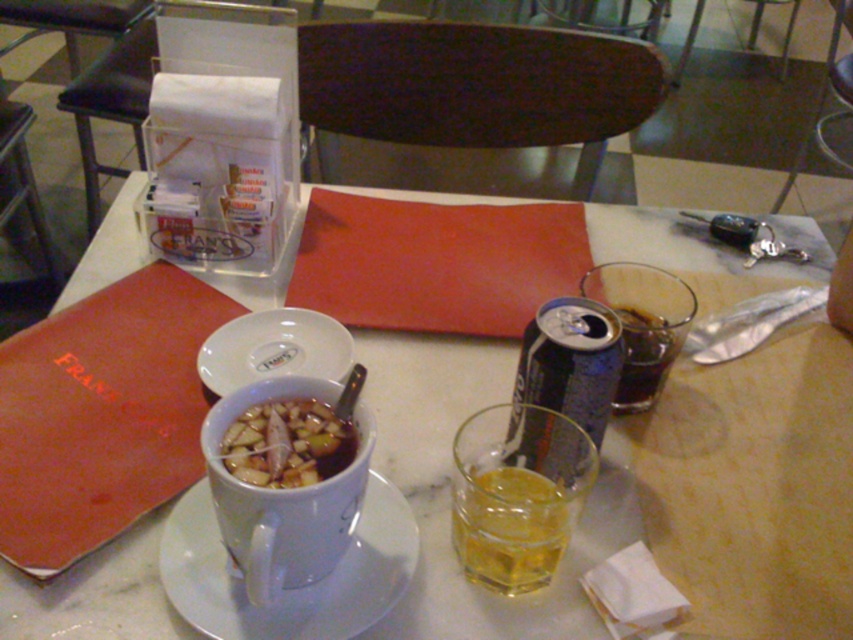
You are a customer at a restaurant and want to grab a drink. You see the metallic silver can at center and the dark brown carbonated can at upper right. Which can is bigger in size?

The metallic silver can at center is larger in size than the dark brown carbonated can at upper right.

You are a server at a restaurant and need to place a new napkin dispenser on the table. The current setup has the white plastic napkin dispenser at center and the white ceramic saucer at center. According to the scene, where should you place the new napkin dispenser so it aligns with the existing arrangement?

The white plastic napkin dispenser at center is located above the white ceramic saucer at center, so you should place the new napkin dispenser above the existing one to maintain alignment.

You are a waiter standing at the edge of the table and need to place a new dish on the white glossy table at center. According to the coordinates provided, where exactly should you place the dish?

The white glossy table at center is located at coordinates point (637, 481), so you should place the dish there.